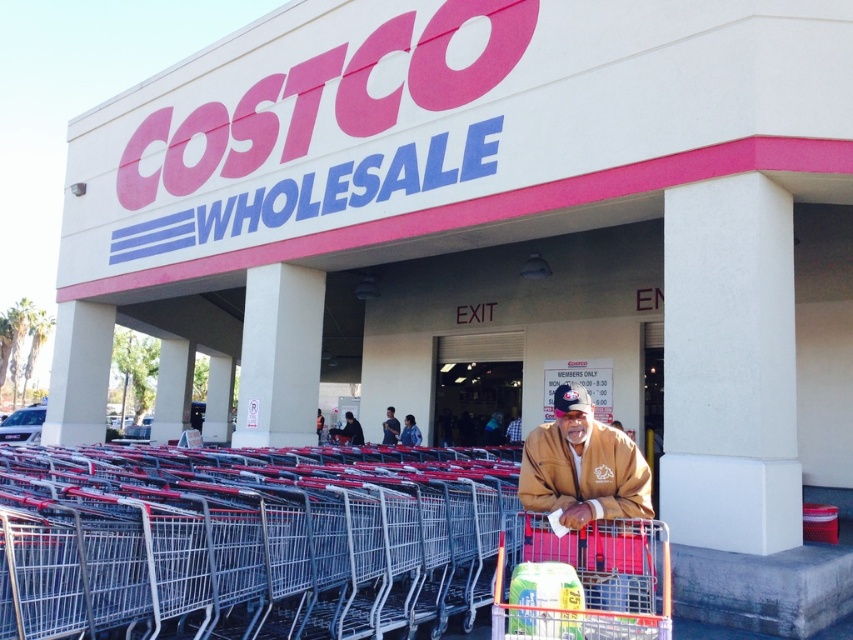
From the picture: Can you confirm if metallic silver shopping cart at center is wider than dark blue fabric jacket at center?

Indeed, metallic silver shopping cart at center has a greater width compared to dark blue fabric jacket at center.

Can you confirm if metallic silver shopping cart at center is taller than dark blue fabric jacket at center?

No.

Who is more forward, (601, 637) or (361, 433)?

Point (601, 637) is more forward.

The image size is (853, 640). I want to click on metallic silver shopping cart at center, so click(x=589, y=580).

Can you confirm if metallic silver shopping cart at center is thinner than blue denim jeans at center?

Incorrect, metallic silver shopping cart at center's width is not less than blue denim jeans at center's.

Identify the location of metallic silver shopping cart at center. This screenshot has height=640, width=853. (589, 580).

You are a GUI agent. You are given a task and a screenshot of the screen. Output one action in this format:
    pyautogui.click(x=<x>, y=<y>)
    Task: Click on the metallic silver shopping cart at center
    
    Given the screenshot: What is the action you would take?
    pyautogui.click(x=589, y=580)

Can you confirm if brown suede jacket at lower right is smaller than blue denim jeans at center?

Incorrect, brown suede jacket at lower right is not smaller in size than blue denim jeans at center.

Which is below, brown suede jacket at lower right or blue denim jeans at center?

Positioned lower is blue denim jeans at center.

Who is more forward, (577,496) or (386,422)?

Point (577,496)

Find the location of a particular element. This screenshot has height=640, width=853. brown suede jacket at lower right is located at coordinates (589, 499).